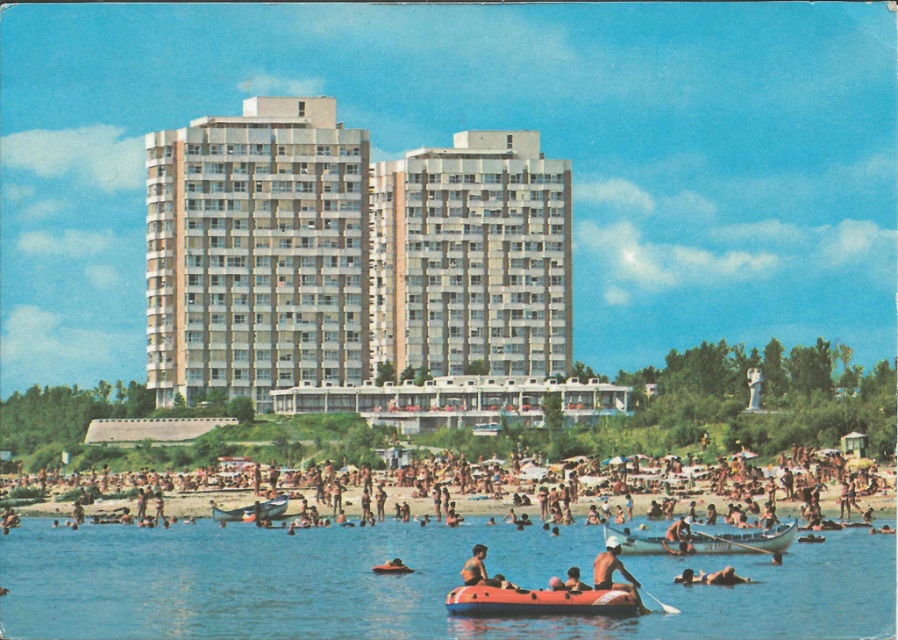
You are a photographer trying to capture a shot of the orange rubber raft at center and the smooth tan skin at lower center. From your current position, which object is positioned to the left?

The orange rubber raft at center is to the left of the smooth tan skin at lower center.

You are a photographer standing at the camera position. You want to capture a closeup shot of the orange rubber raft at center. Considering its distance, what is the minimum focal length lens you need to use to fill the frame? Assume the sensor size is 36mm x 24mm and the raft is 2 meters in length.

The orange rubber raft at center is 93.67 meters away from the camera. To fill the frame with a 2m long raft on a 24mm height sensor, the required focal length is approximately 1.26mm. However, typical camera lenses don not go that low, so a longer focal length would be needed for a closer crop without filling the entire frame.

You are standing at the camera position and want to reach the point at coordinates point (609, 548). What is the approximate distance you need to cover to reach that point?

The distance of point (609, 548) from camera is 100.52 meters, so you need to cover approximately 100.52 meters to reach that point.